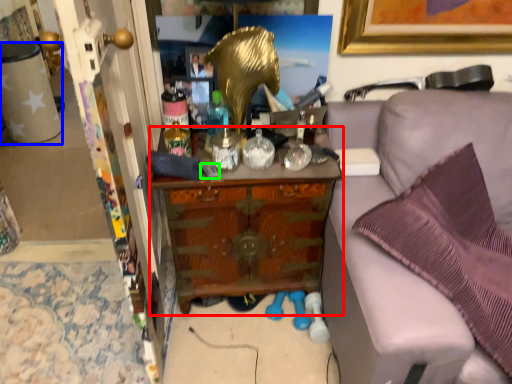
Question: Considering the real-world distances, which object is closest to cabinetry (highlighted by a red box)? desk (highlighted by a blue box) or remote control (highlighted by a green box).

Choices:
 (A) desk
 (B) remote control

Answer: (B)